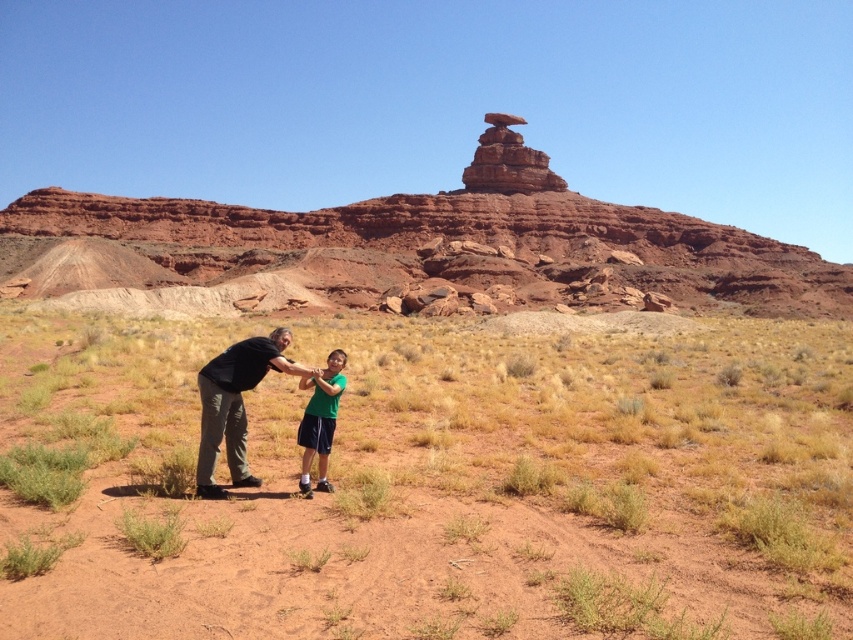
Question: Does brown dirt at center appear on the left side of dark gray pants at center?

Choices:
 (A) yes
 (B) no

Answer: (B)

Question: Which of the following is the closest to the observer?

Choices:
 (A) brown dirt at center
 (B) green matte shirt at center

Answer: (A)

Question: Does brown dirt at center have a greater width compared to green matte shirt at center?

Choices:
 (A) no
 (B) yes

Answer: (B)

Question: Which object is the closest to the dark gray pants at center?

Choices:
 (A) brown dirt at center
 (B) green matte shirt at center

Answer: (B)

Question: Which of the following is the farthest from the observer?

Choices:
 (A) green matte shirt at center
 (B) dark gray pants at center

Answer: (A)

Question: Is brown dirt at center positioned in front of green matte shirt at center?

Choices:
 (A) no
 (B) yes

Answer: (B)